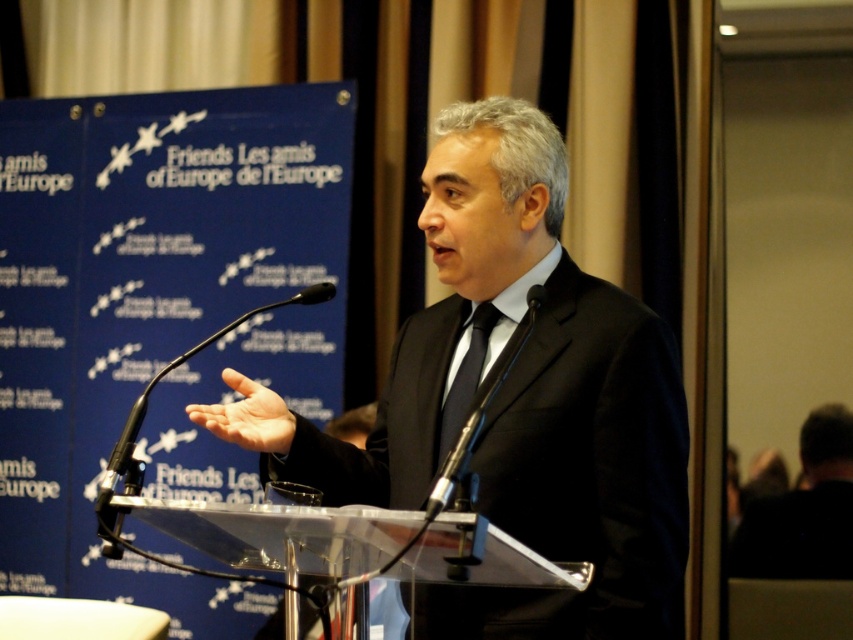
Question: Is black suit at right below black silk tie at center?

Choices:
 (A) yes
 (B) no

Answer: (A)

Question: Among these objects, which one is nearest to the camera?

Choices:
 (A) black silk tie at center
 (B) black matte suit at center

Answer: (B)

Question: Which point appears farthest from the camera in this image?

Choices:
 (A) [305, 296]
 (B) [442, 435]
 (C) [440, 260]
 (D) [810, 460]

Answer: (D)

Question: Is black suit at right to the right of black silk tie at center from the viewer's perspective?

Choices:
 (A) no
 (B) yes

Answer: (B)

Question: Which object appears closest to the camera in this image?

Choices:
 (A) black suit at right
 (B) black silk tie at center
 (C) black metallic microphone at center
 (D) black matte suit at center

Answer: (C)

Question: Does black matte suit at center come behind black metallic microphone at center?

Choices:
 (A) no
 (B) yes

Answer: (B)